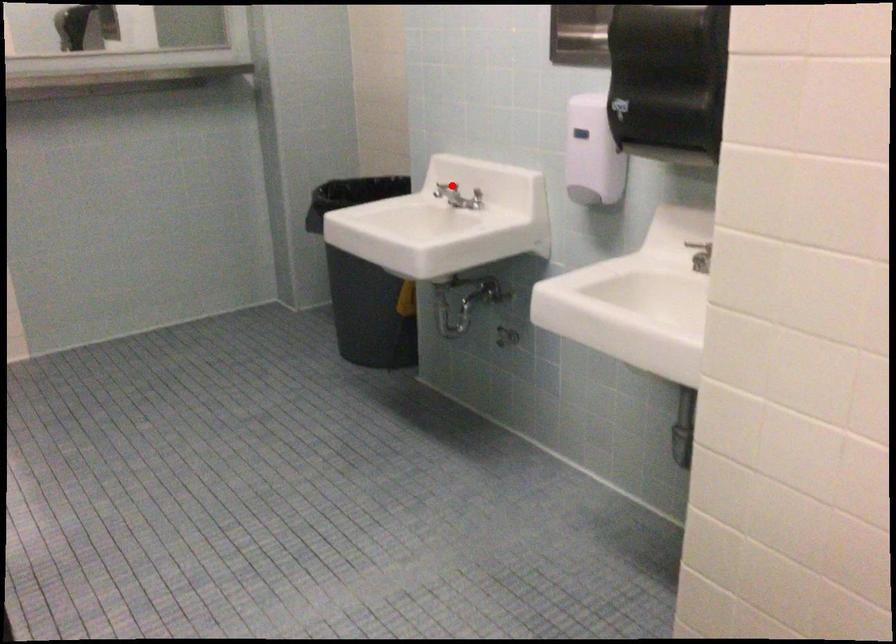
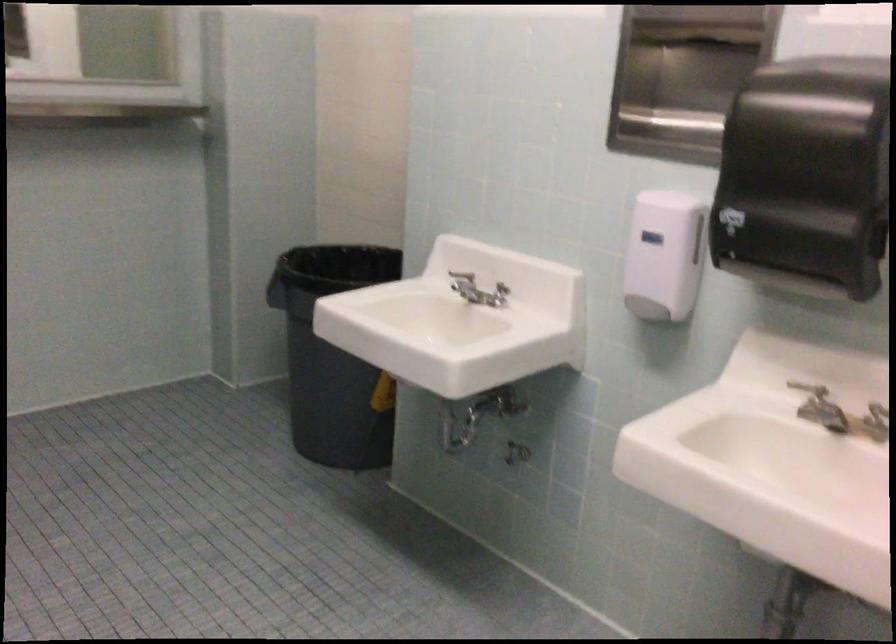
Question: A red point is marked in image1. In image2, is the corresponding 3D point closer to the camera or farther? Reply with the corresponding letter.

Choices:
 (A) The corresponding 3D point is closer.
 (B) The corresponding 3D point is farther.

Answer: (A)